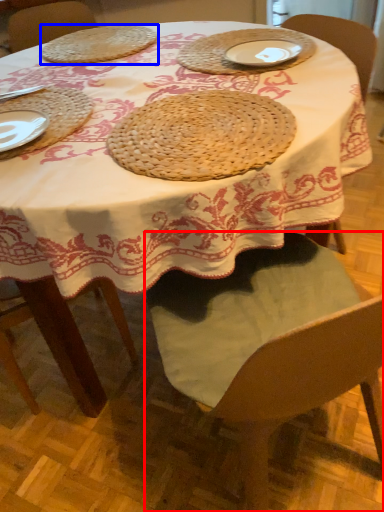
Question: Which of the following is the closest to the observer, chair (highlighted by a red box) or pie (highlighted by a blue box)?

Choices:
 (A) chair
 (B) pie

Answer: (A)